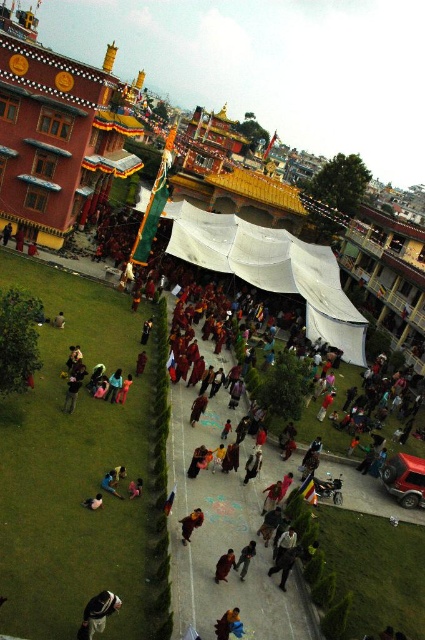
Can you confirm if orange fabric at lower center is taller than dark blue fabric at lower left?

Indeed, orange fabric at lower center has a greater height compared to dark blue fabric at lower left.

Describe the element at coordinates (190, 524) in the screenshot. I see `orange fabric at lower center` at that location.

The width and height of the screenshot is (425, 640). Identify the location of orange fabric at lower center. (190, 524).

Does white fabric canopy at center appear under dark brown leather jacket at lower left?

No.

Can you confirm if white fabric canopy at center is smaller than dark brown leather jacket at lower left?

Actually, white fabric canopy at center might be larger than dark brown leather jacket at lower left.

Measure the distance between point (268, 282) and camera.

Point (268, 282) and camera are 60.26 meters apart.

This screenshot has width=425, height=640. Find the location of `white fabric canopy at center`. white fabric canopy at center is located at coordinates (272, 269).

From the picture: Measure the distance between white fabric canopy at center and dark blue fabric at lower left.

128.59 feet

From the picture: Can you confirm if white fabric canopy at center is shorter than dark blue fabric at lower left?

No, white fabric canopy at center is not shorter than dark blue fabric at lower left.

Where is `white fabric canopy at center`? This screenshot has height=640, width=425. white fabric canopy at center is located at coordinates (272, 269).